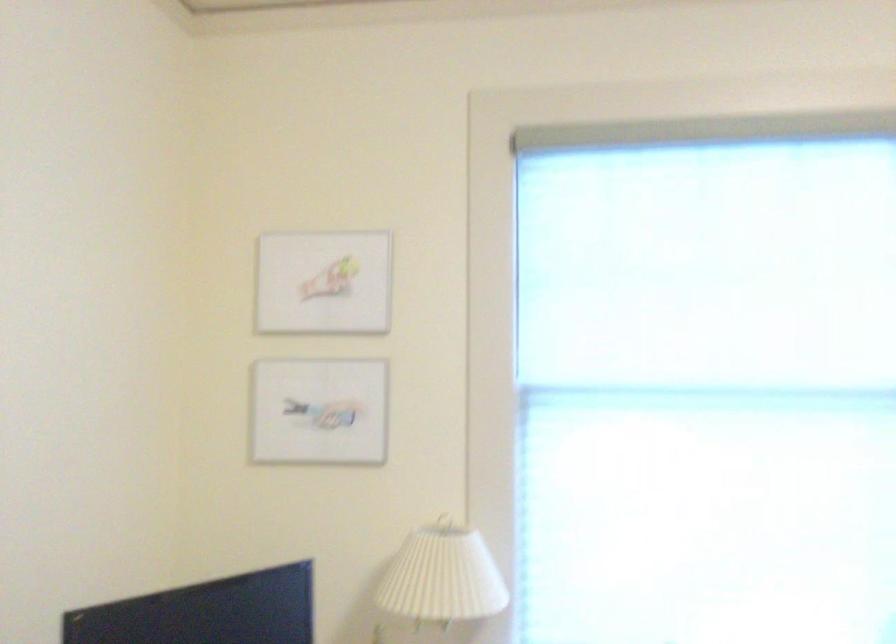
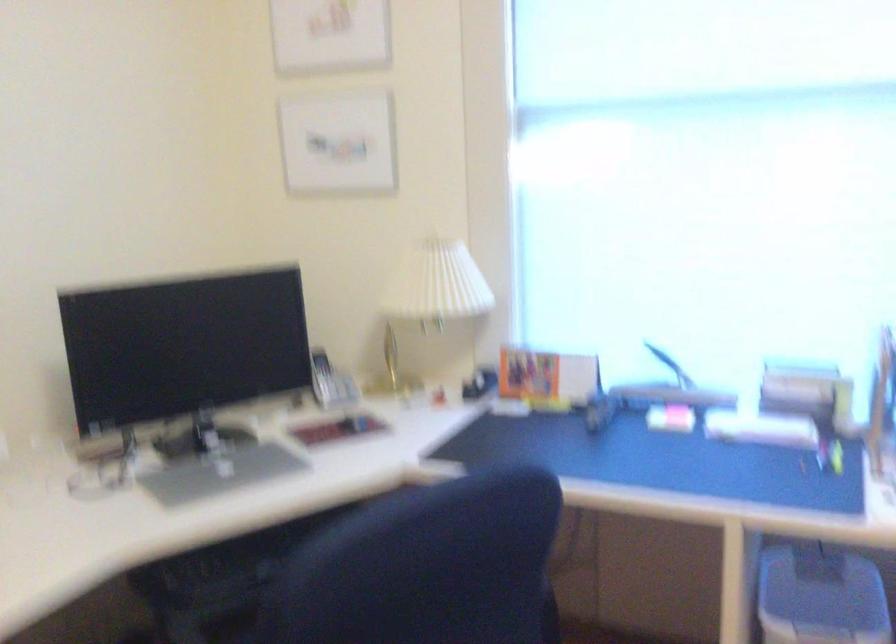
Based on the continuous images, in which direction is the camera rotating?

The camera's rotation is toward left-down.